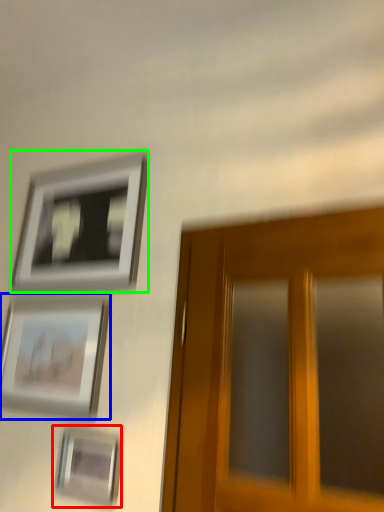
Question: Which object is positioned closest to picture frame (highlighted by a red box)? Select from picture frame (highlighted by a blue box) and picture frame (highlighted by a green box).

Choices:
 (A) picture frame
 (B) picture frame

Answer: (A)